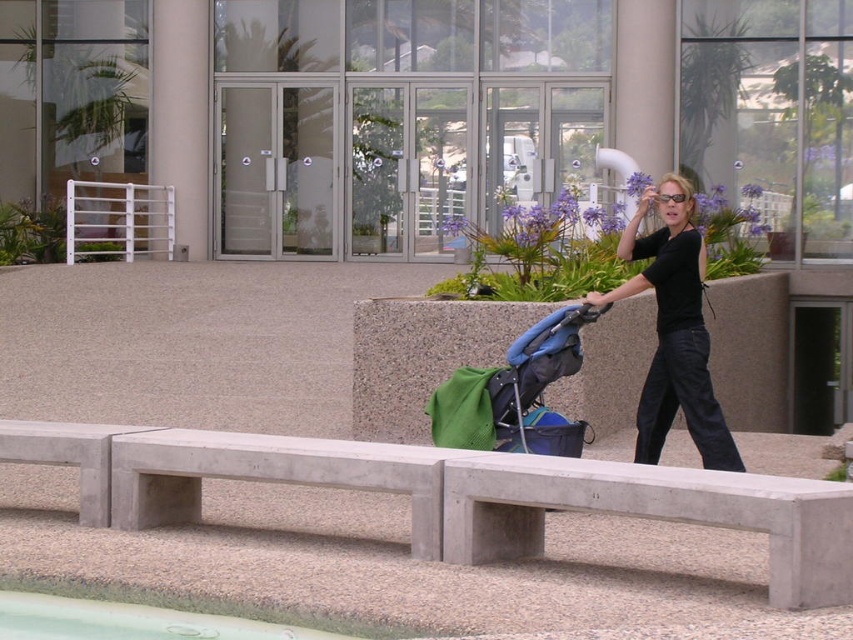
You are a photographer trying to capture the scene. The black matte shirt at center and the white metal rail at upper left are both in your viewfinder. Which object is closer to the camera?

The black matte shirt at center is closer to the camera because it is in front of the white metal rail at upper left.

You are standing at the point marked by the coordinates point (129, 621) in the image. Looking around, you see the woman pushing the stroller and the concrete bench with pebbles. Which direction should you walk to reach the woman and the stroller?

The point (129, 621) corresponds to the green smooth pool at lower left. Since the woman and the stroller are in the scene, you should walk towards the upper right direction to reach them from the pool location.